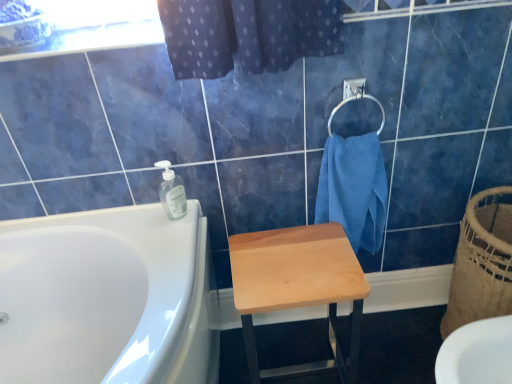
You are a GUI agent. You are given a task and a screenshot of the screen. Output one action in this format:
    pyautogui.click(x=<x>, y=<y>)
    Task: Click on the free space above transparent glass window screen at upper left (from a real-world perspective)
    
    Given the screenshot: What is the action you would take?
    pyautogui.click(x=90, y=29)